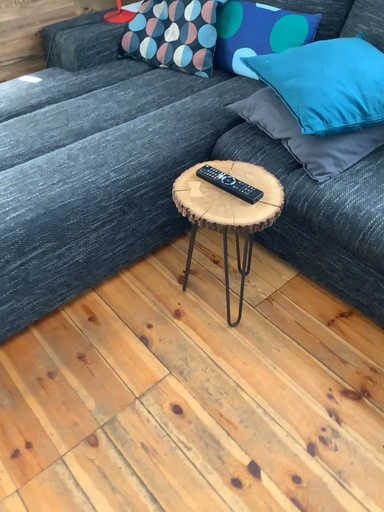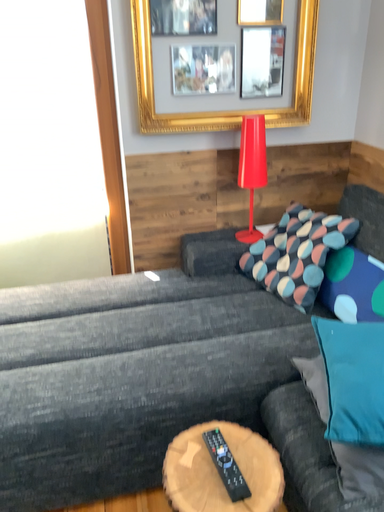
Question: How did the camera likely rotate when shooting the video?

Choices:
 (A) rotated right
 (B) rotated left

Answer: (B)